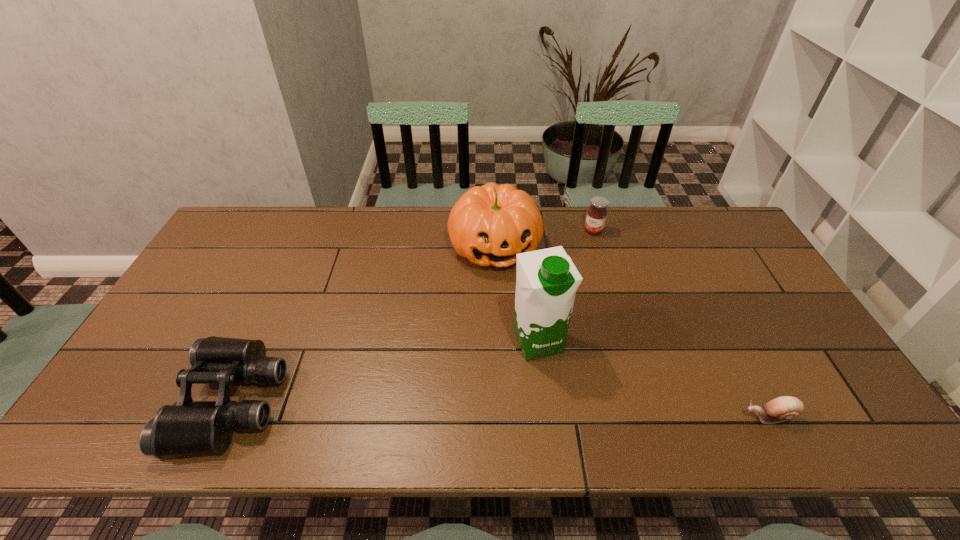
Identify the location of object positioned at the near right corner. (783, 408).

Locate an element on the screen. The height and width of the screenshot is (540, 960). vacant space at the far edge is located at coordinates coord(319,244).

The height and width of the screenshot is (540, 960). In order to click on free region at the near edge in this screenshot , I will do `click(310, 380)`.

In the image, there is a desktop. Where is `free space at the left edge`? free space at the left edge is located at coordinates (188, 362).

At what (x,y) coordinates should I click in order to perform the action: click on free space at the right edge. Please return your answer as a coordinate pair (x, y). This screenshot has width=960, height=540. Looking at the image, I should click on (726, 259).

What are the coordinates of `blank space at the far left corner of the desktop` in the screenshot? It's located at (279, 215).

Locate an element on the screen. free area in between the tallest object and the binoculars is located at coordinates (385, 372).

Locate an element on the screen. blank region between the leftmost object and the second object from right to left is located at coordinates (413, 316).

Where is `vacant region between the shortest object and the leftmost object`? The height and width of the screenshot is (540, 960). vacant region between the shortest object and the leftmost object is located at coordinates (500, 409).

Find the location of `vacant region between the soya milk and the leftmost object`. vacant region between the soya milk and the leftmost object is located at coordinates point(385,372).